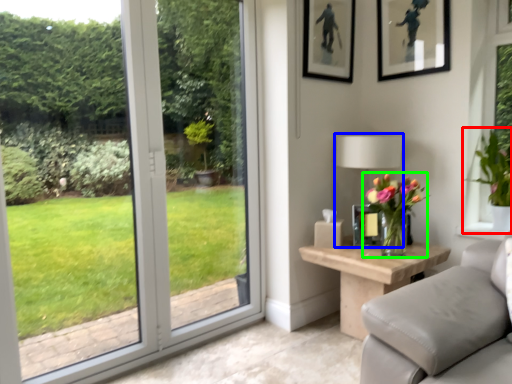
Question: Which object is positioned farthest from houseplant (highlighted by a red box)? Select from table lamp (highlighted by a blue box) and houseplant (highlighted by a green box).

Choices:
 (A) table lamp
 (B) houseplant

Answer: (B)